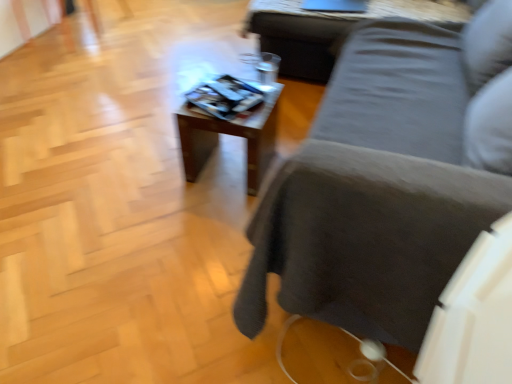
Question: Can you confirm if wooden table at upper center, placed as the first table when sorted from top to bottom, is bigger than dark gray fabric couch at center?

Choices:
 (A) yes
 (B) no

Answer: (B)

Question: Does wooden table at upper center, which is the first table in right-to-left order, have a lesser width compared to dark gray fabric couch at center?

Choices:
 (A) yes
 (B) no

Answer: (A)

Question: Is wooden table at upper center, which is the first table in right-to-left order, wider than dark gray fabric couch at center?

Choices:
 (A) yes
 (B) no

Answer: (B)

Question: From the image's perspective, is wooden table at upper center, the 2th table in the left-to-right sequence, above dark gray fabric couch at center?

Choices:
 (A) no
 (B) yes

Answer: (B)

Question: From the image's perspective, is wooden table at upper center, the 2th table in the left-to-right sequence, located beneath dark gray fabric couch at center?

Choices:
 (A) yes
 (B) no

Answer: (B)

Question: Is wooden table at upper center, which is the 1th table from back to front, further to the viewer compared to dark gray fabric couch at center?

Choices:
 (A) no
 (B) yes

Answer: (B)

Question: Considering the relative sizes of wooden table at center, which is the 2th table in back-to-front order, and dark gray fabric couch at center in the image provided, is wooden table at center, which is the 2th table in back-to-front order, thinner than dark gray fabric couch at center?

Choices:
 (A) no
 (B) yes

Answer: (B)

Question: From the image's perspective, would you say wooden table at center, acting as the 2th table starting from the right, is positioned over dark gray fabric couch at center?

Choices:
 (A) no
 (B) yes

Answer: (B)

Question: From a real-world perspective, is wooden table at center, acting as the 2th table starting from the right, positioned under dark gray fabric couch at center based on gravity?

Choices:
 (A) yes
 (B) no

Answer: (A)

Question: From a real-world perspective, is wooden table at center, acting as the 2th table starting from the right, over dark gray fabric couch at center?

Choices:
 (A) yes
 (B) no

Answer: (B)

Question: From the image's perspective, is wooden table at center, which is the 2th table in top-to-bottom order, beneath dark gray fabric couch at center?

Choices:
 (A) no
 (B) yes

Answer: (A)

Question: Does wooden table at center, which ranks as the 1th table in left-to-right order, have a larger size compared to dark gray fabric couch at center?

Choices:
 (A) yes
 (B) no

Answer: (B)

Question: Can we say wooden table at center, which is the 2th table in top-to-bottom order, lies outside wooden table at upper center, the 2th table in the left-to-right sequence?

Choices:
 (A) yes
 (B) no

Answer: (A)